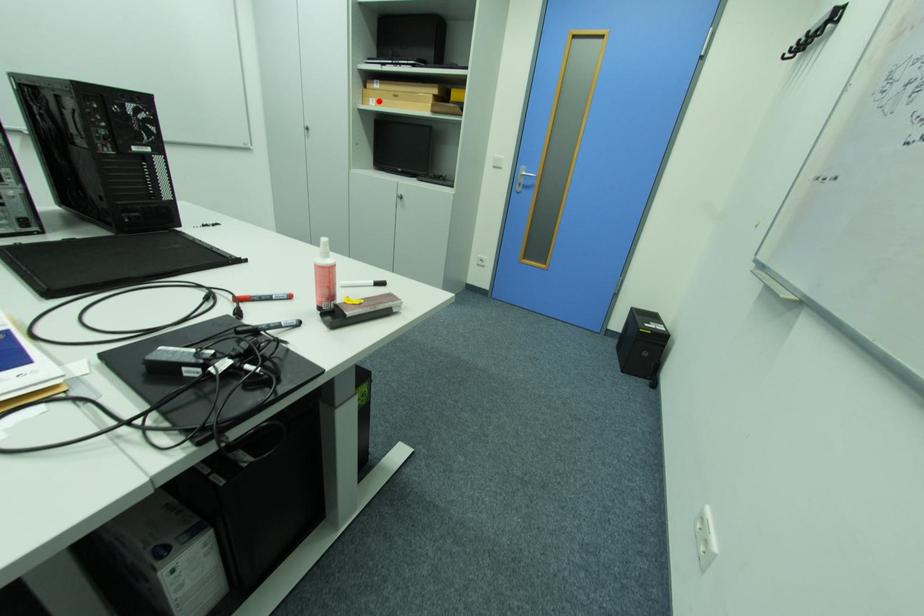
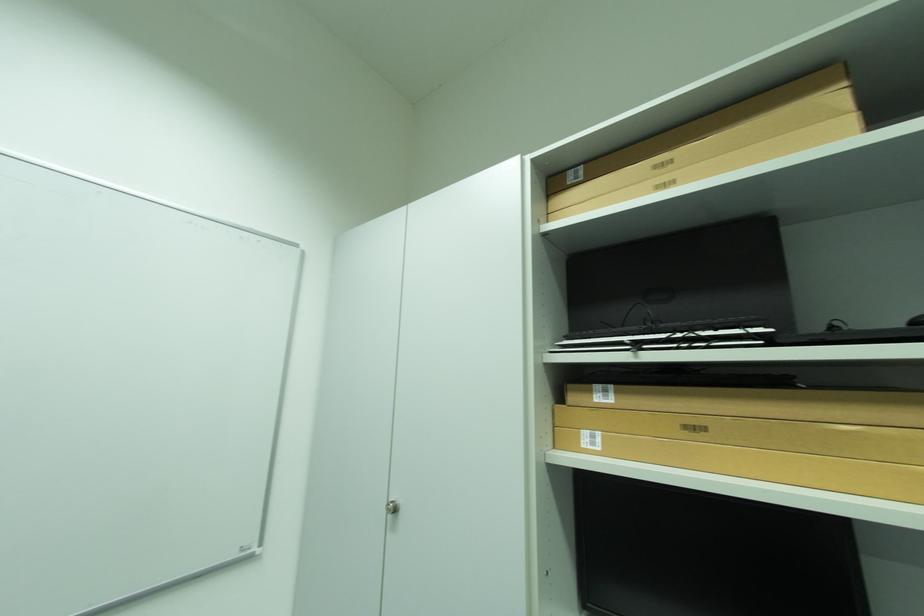
Find the pixel in the second image that matches the highlighted location in the first image.

(593, 434)